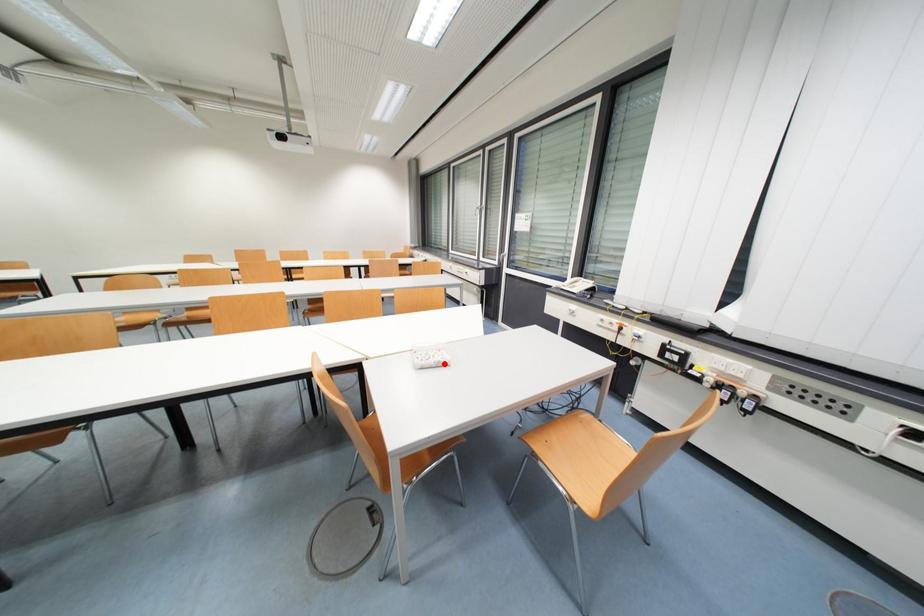
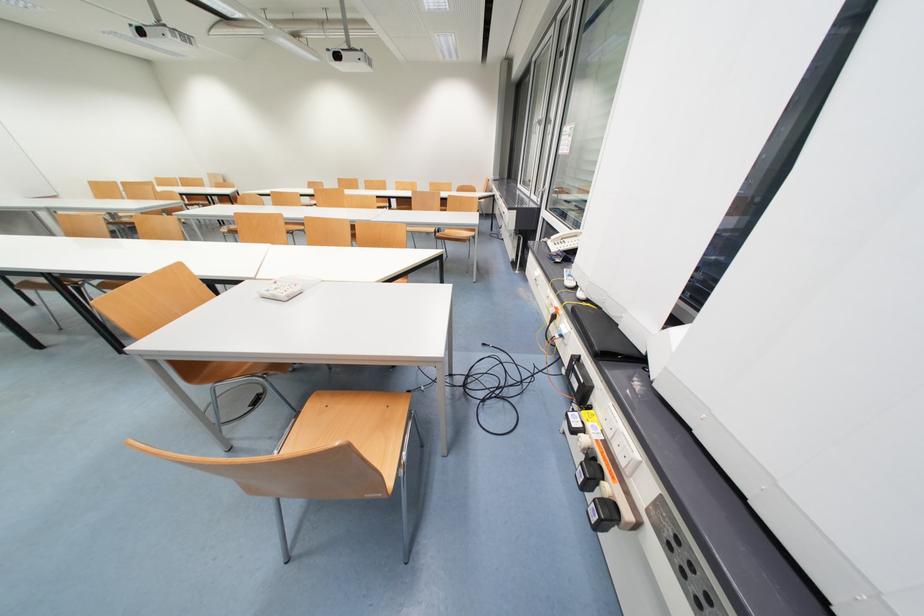
Locate, in the second image, the point that corresponds to the highlighted location in the first image.

(280, 297)